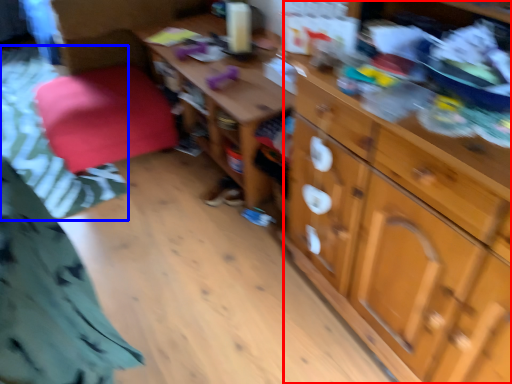
Question: Among these objects, which one is nearest to the camera, cabinetry (highlighted by a red box) or bedding (highlighted by a blue box)?

Choices:
 (A) cabinetry
 (B) bedding

Answer: (A)